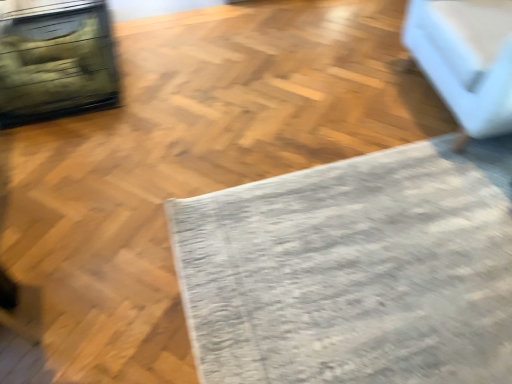
Question: Is white fabric couch at upper right spatially inside gray textured mat at center, or outside of it?

Choices:
 (A) outside
 (B) inside

Answer: (A)

Question: In terms of width, does white fabric couch at upper right look wider or thinner when compared to gray textured mat at center?

Choices:
 (A) thin
 (B) wide

Answer: (A)

Question: Is white fabric couch at upper right taller or shorter than gray textured mat at center?

Choices:
 (A) short
 (B) tall

Answer: (B)

Question: Is gray textured mat at center wider or thinner than white fabric couch at upper right?

Choices:
 (A) thin
 (B) wide

Answer: (B)

Question: From the image's perspective, is gray textured mat at center positioned above or below white fabric couch at upper right?

Choices:
 (A) below
 (B) above

Answer: (A)

Question: From a real-world perspective, is gray textured mat at center positioned above or below white fabric couch at upper right?

Choices:
 (A) below
 (B) above

Answer: (A)

Question: Considering the positions of gray textured mat at center and white fabric couch at upper right in the image, is gray textured mat at center taller or shorter than white fabric couch at upper right?

Choices:
 (A) short
 (B) tall

Answer: (A)